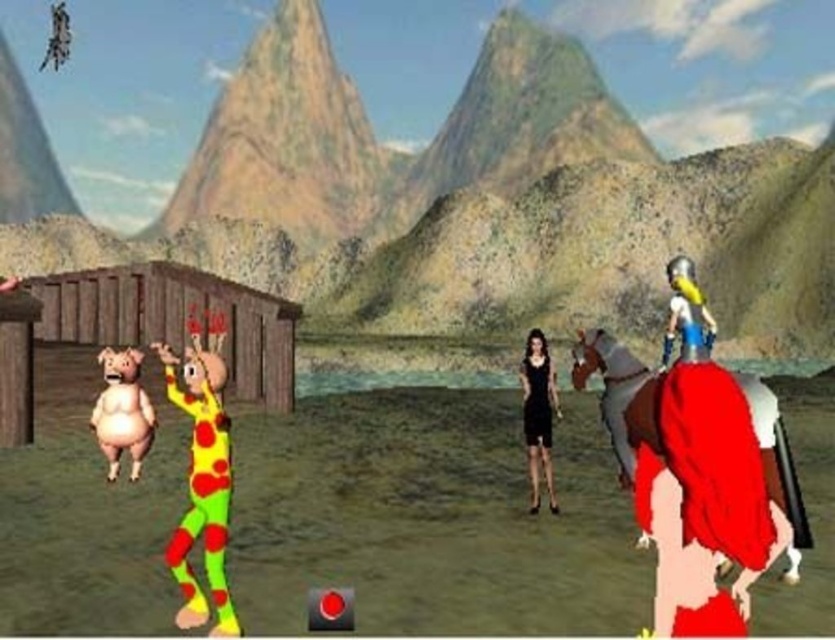
You are a character in the game and need to determine which of the two points, point (110, 451) or point (553, 408), is closer to your current position. Based on the scene, which point is nearer?

Point (110, 451) is closer to the camera than point (553, 408), so it is nearer.

You are standing at the center of the scene and want to hand a gift to both the shiny red cape at right and the black satin dress at center. Which one should you approach first to ensure you can reach them without moving past the other?

You should approach the shiny red cape at right first because it is closer to you than the black satin dress at center.